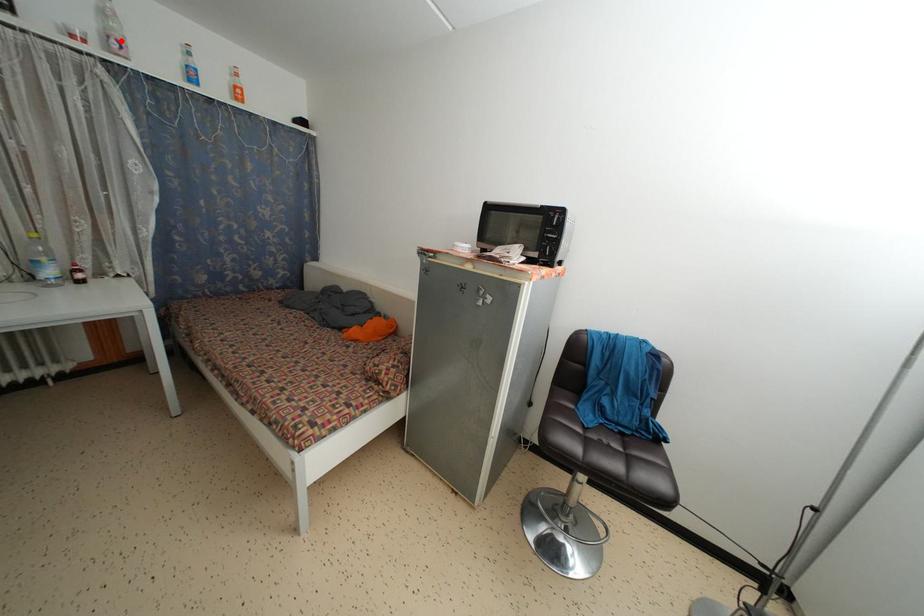
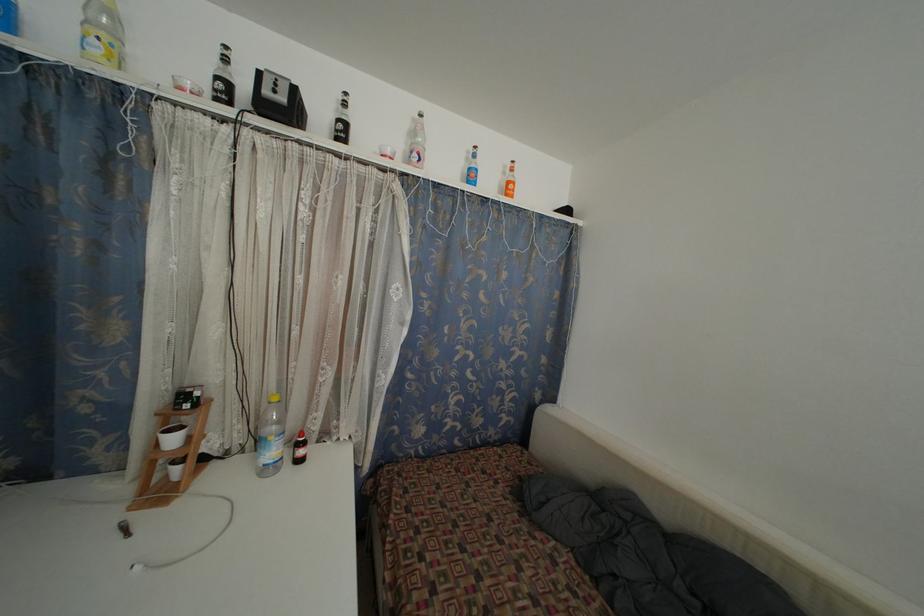
Question: I am providing you with two images of the same scene from different viewpoints. In image1, a red point is highlighted. Considering the same 3D point in image2, which of the following is correct?

Choices:
 (A) It is closer
 (B) It is farther

Answer: (A)